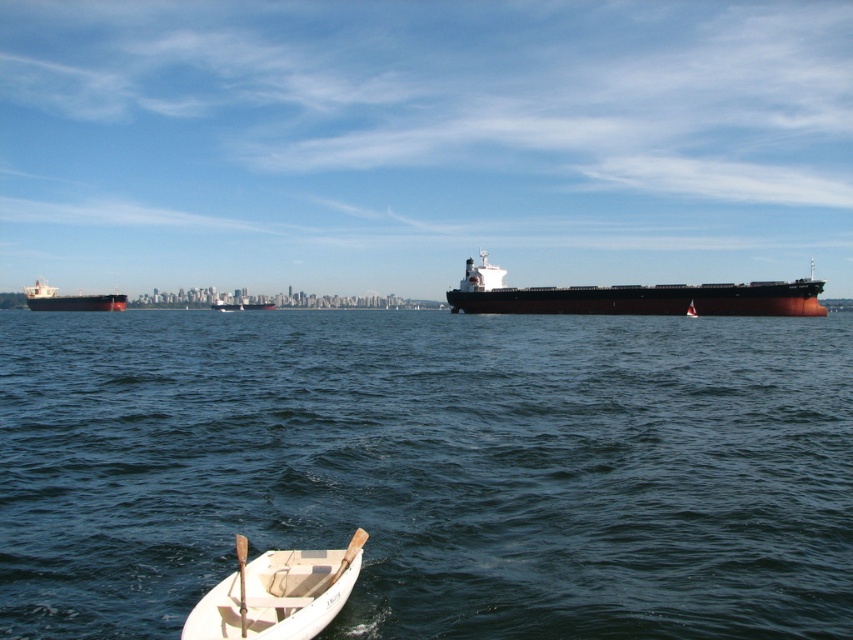
Between white matte boat at lower center and dark brown matte cargo ship at center, which one appears on the right side from the viewer's perspective?

Positioned to the right is dark brown matte cargo ship at center.

Describe the element at coordinates (277, 593) in the screenshot. I see `white matte boat at lower center` at that location.

Where is `white matte boat at lower center`? This screenshot has height=640, width=853. white matte boat at lower center is located at coordinates pos(277,593).

Does dark blue water at center appear on the right side of white matte boat at lower center?

No, dark blue water at center is not to the right of white matte boat at lower center.

Can you confirm if dark blue water at center is positioned to the left of white matte boat at lower center?

Correct, you'll find dark blue water at center to the left of white matte boat at lower center.

Describe the element at coordinates (431, 468) in the screenshot. I see `dark blue water at center` at that location.

At what (x,y) coordinates should I click in order to perform the action: click on dark blue water at center. Please return your answer as a coordinate pair (x, y). Looking at the image, I should click on (431, 468).

Locate an element on the screen. The width and height of the screenshot is (853, 640). dark brown matte cargo ship at center is located at coordinates (633, 296).

Does dark brown matte cargo ship at center appear on the right side of matte black ship at left?

Indeed, dark brown matte cargo ship at center is positioned on the right side of matte black ship at left.

Between point (546, 288) and point (88, 305), which one is positioned in front?

Point (546, 288)

Locate an element on the screen. dark brown matte cargo ship at center is located at coordinates (633, 296).